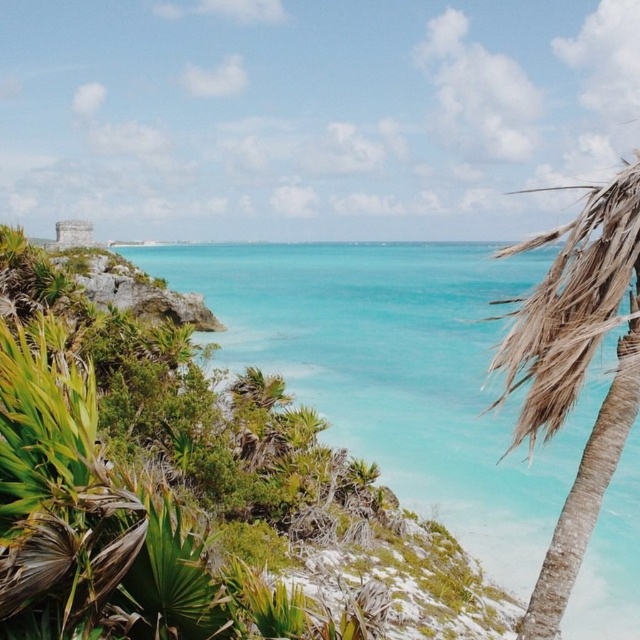
Question: Considering the relative positions of turquoise water at center and brown textured palm tree at right in the image provided, where is turquoise water at center located with respect to brown textured palm tree at right?

Choices:
 (A) left
 (B) right

Answer: (A)

Question: Which of the following is the closest to the observer?

Choices:
 (A) (554, 492)
 (B) (572, 292)

Answer: (B)

Question: Which object appears farthest from the camera in this image?

Choices:
 (A) brown textured palm tree at right
 (B) turquoise water at center

Answer: (B)

Question: Does turquoise water at center appear on the right side of brown textured palm tree at right?

Choices:
 (A) yes
 (B) no

Answer: (B)

Question: Which point is closer to the camera?

Choices:
 (A) turquoise water at center
 (B) brown textured palm tree at right

Answer: (B)

Question: From the image, what is the correct spatial relationship of turquoise water at center in relation to brown textured palm tree at right?

Choices:
 (A) left
 (B) right

Answer: (A)